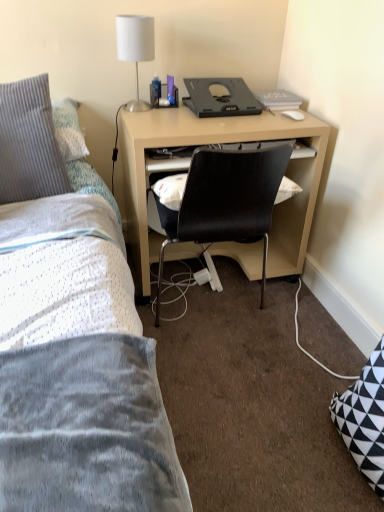
This screenshot has height=512, width=384. What are the coordinates of `vacant space underneath white fabric lampshade at upper center (from a real-world perspective)` in the screenshot? It's located at (141, 108).